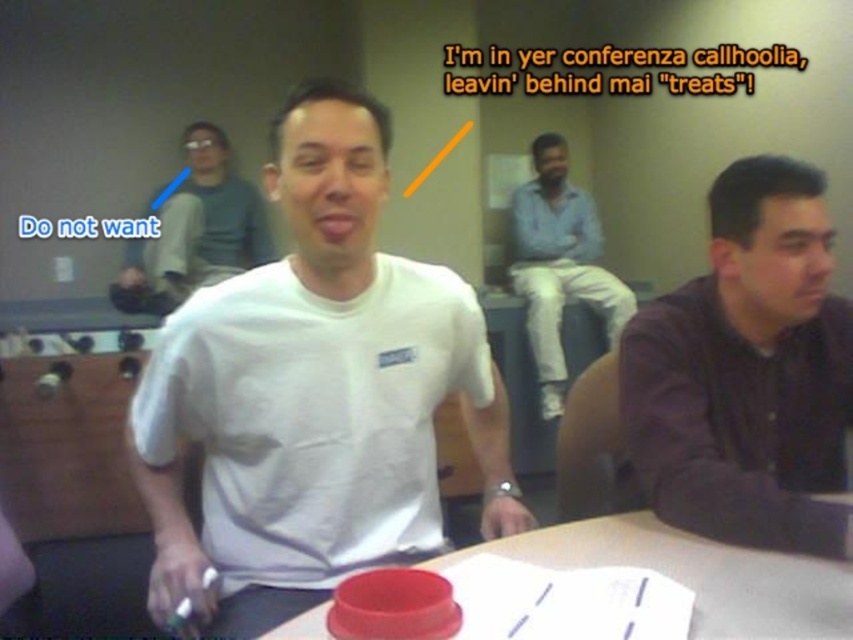
Question: Is white matte t-shirt at center wider than dark purple shirt at right?

Choices:
 (A) yes
 (B) no

Answer: (A)

Question: Which object is the farthest from the white matte t-shirt at center?

Choices:
 (A) smooth plastic lid at center
 (B) matte white t-shirt at center
 (C) dark purple shirt at right

Answer: (B)

Question: Does white matte t-shirt at center come behind light blue shirt at center?

Choices:
 (A) yes
 (B) no

Answer: (B)

Question: Estimate the real-world distances between objects in this image. Which object is farther from the matte white t-shirt at center?

Choices:
 (A) dark purple shirt at right
 (B) light blue shirt at center

Answer: (A)

Question: Estimate the real-world distances between objects in this image. Which object is closer to the smooth plastic lid at center?

Choices:
 (A) matte white t-shirt at center
 (B) white matte t-shirt at center
 (C) dark purple shirt at right

Answer: (C)

Question: Can you confirm if smooth plastic lid at center is smaller than light blue shirt at center?

Choices:
 (A) no
 (B) yes

Answer: (B)